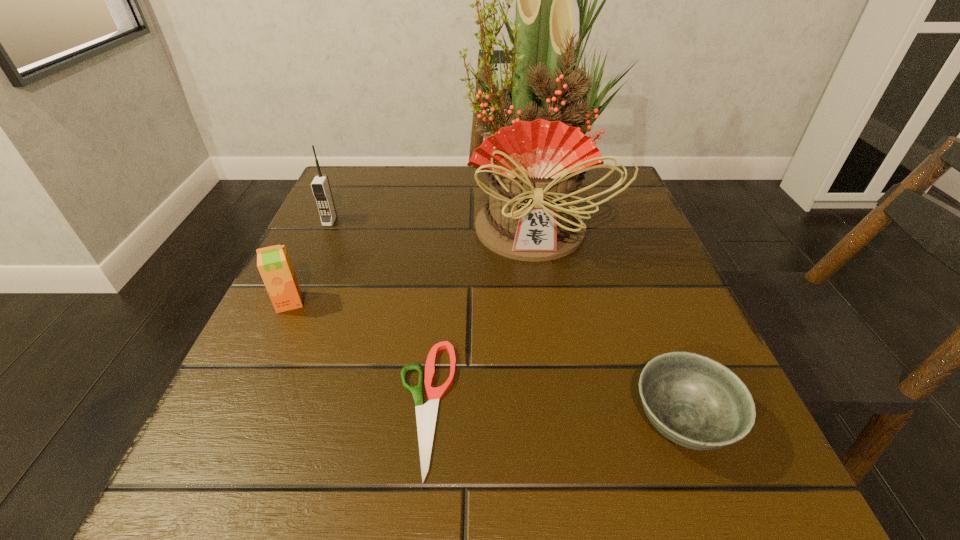
Find the location of a particular element. The width and height of the screenshot is (960, 540). vacant point located on the left of the shortest object is located at coordinates (225, 406).

The image size is (960, 540). What are the coordinates of `flower arrangement at the far edge` in the screenshot? It's located at (535, 162).

Find the location of a particular element. cellular telephone present at the far edge is located at coordinates coord(320,185).

Identify the location of bowl located at the near edge. This screenshot has width=960, height=540. (694, 401).

The image size is (960, 540). I want to click on scissors situated at the near edge, so click(x=426, y=415).

Locate an element on the screen. This screenshot has width=960, height=540. cellular telephone at the left edge is located at coordinates (320, 185).

You are a GUI agent. You are given a task and a screenshot of the screen. Output one action in this format:
    pyautogui.click(x=<x>, y=<y>)
    Task: Click on the orange juice that is at the left edge
    The image size is (960, 540).
    Given the screenshot: What is the action you would take?
    pyautogui.click(x=273, y=262)

Image resolution: width=960 pixels, height=540 pixels. I want to click on flower arrangement at the right edge, so click(x=535, y=162).

Locate an element on the screen. The width and height of the screenshot is (960, 540). bowl that is at the right edge is located at coordinates pyautogui.click(x=694, y=401).

Where is `object situated at the far left corner`? The image size is (960, 540). object situated at the far left corner is located at coordinates (320, 185).